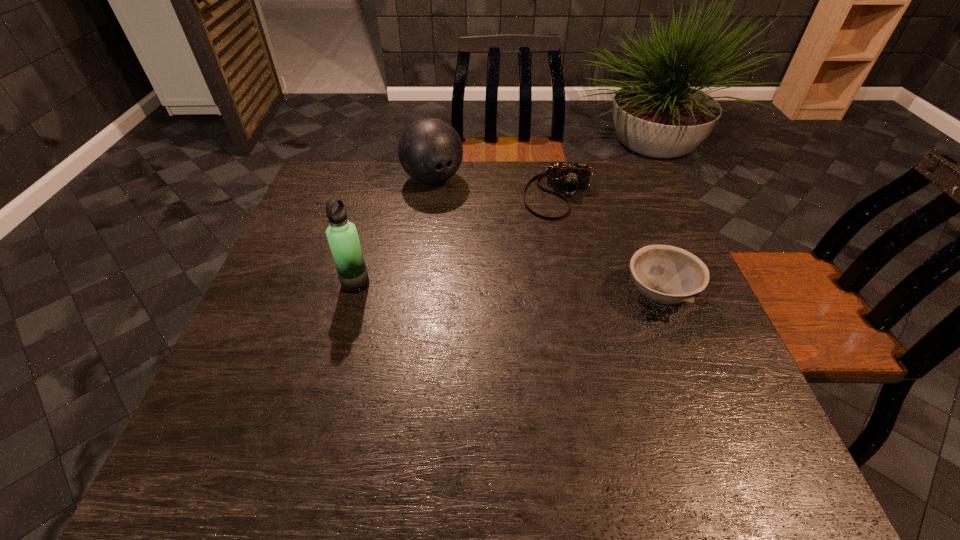
What are the coordinates of `vacant point at the right edge` in the screenshot? It's located at (654, 238).

Identify the location of vacant space at the far right corner of the desktop. (646, 192).

Where is `free area in between the bowl and the third shortest object`? The height and width of the screenshot is (540, 960). free area in between the bowl and the third shortest object is located at coordinates (546, 237).

Find the location of a particular element. Image resolution: width=960 pixels, height=540 pixels. vacant region between the shortest object and the bowl is located at coordinates (609, 245).

Image resolution: width=960 pixels, height=540 pixels. What are the coordinates of `free space between the tallest object and the third tallest object` in the screenshot? It's located at (508, 289).

Where is `free area in between the second tallest object and the camera`? Image resolution: width=960 pixels, height=540 pixels. free area in between the second tallest object and the camera is located at coordinates (496, 187).

Identify the location of free point between the tallest object and the third tallest object. (508, 289).

Where is `vacant area that lies between the shortest object and the second tallest object`? vacant area that lies between the shortest object and the second tallest object is located at coordinates (496, 187).

Where is `free point between the bowling ball and the leftmost object`? The height and width of the screenshot is (540, 960). free point between the bowling ball and the leftmost object is located at coordinates (395, 232).

Where is `free space between the tallest object and the bowl`? This screenshot has width=960, height=540. free space between the tallest object and the bowl is located at coordinates (508, 289).